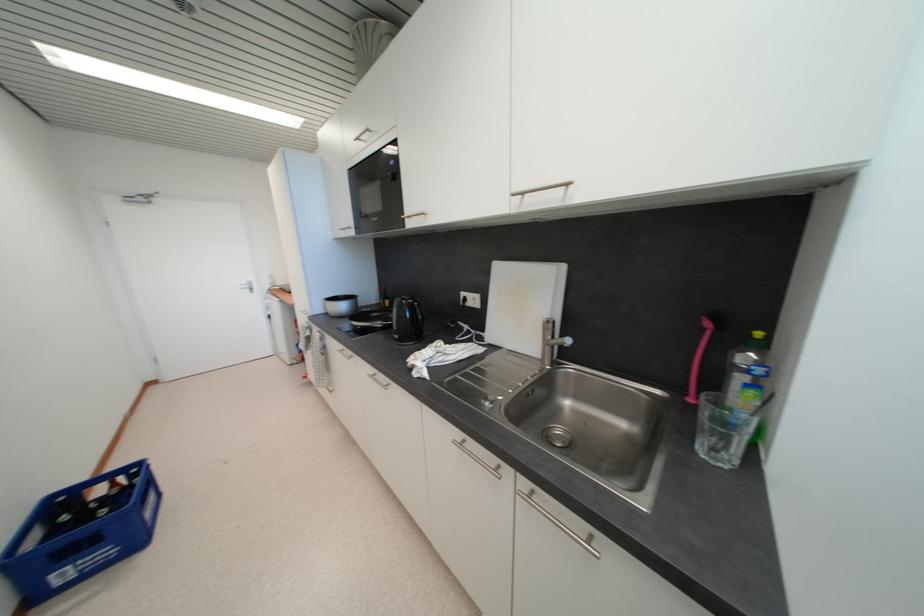
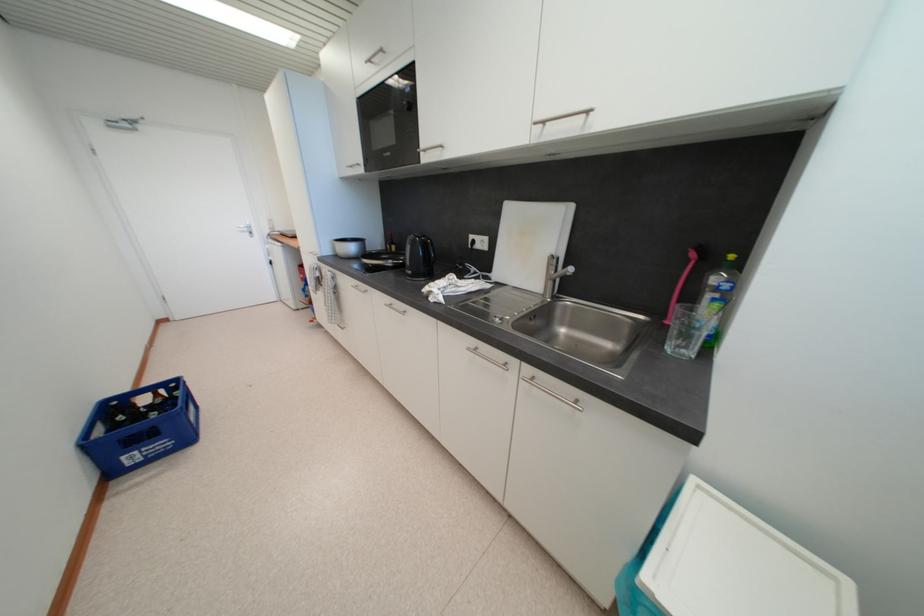
Locate, in the second image, the point that corresponds to the point at 558,339 in the first image.

(561, 275)